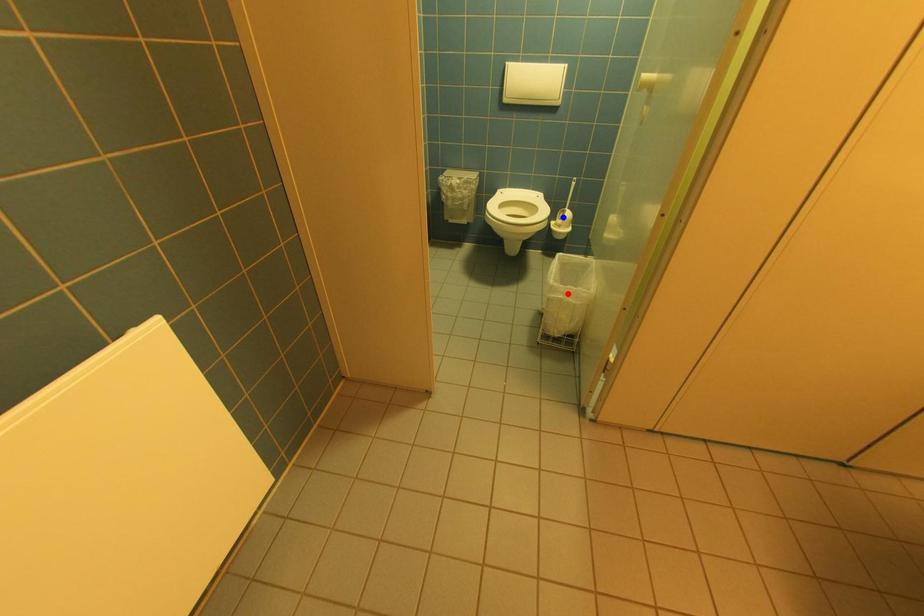
Question: Which of the two points in the image is closer to the camera?

Choices:
 (A) Blue point is closer.
 (B) Red point is closer.

Answer: (B)